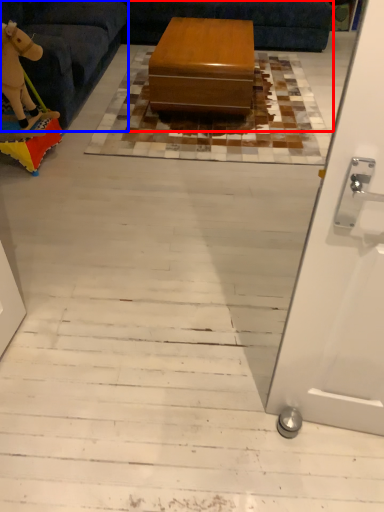
Question: Which point is closer to the camera, couch (highlighted by a red box) or furniture (highlighted by a blue box)?

Choices:
 (A) couch
 (B) furniture

Answer: (A)